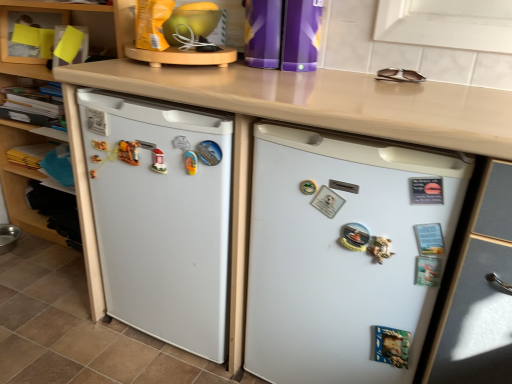
Question: Is white matte refrigerator at left, which is the second refrigerator from right to left, a part of wooden shelf at lower left, the 2th shelf from the top?

Choices:
 (A) yes
 (B) no

Answer: (B)

Question: Does wooden shelf at lower left, the 2th shelf from the top, have a larger size compared to white matte refrigerator at left, which ranks as the first refrigerator in left-to-right order?

Choices:
 (A) no
 (B) yes

Answer: (A)

Question: From the image's perspective, is wooden shelf at lower left, which is the first shelf in bottom-to-top order, on white matte refrigerator at left, which ranks as the first refrigerator in left-to-right order?

Choices:
 (A) yes
 (B) no

Answer: (B)

Question: Does wooden shelf at lower left, which is the first shelf in bottom-to-top order, appear on the right side of white matte refrigerator at left, which is the second refrigerator from right to left?

Choices:
 (A) yes
 (B) no

Answer: (B)

Question: Is wooden shelf at lower left, which is the first shelf in bottom-to-top order, further to camera compared to white matte refrigerator at left, which is the second refrigerator from right to left?

Choices:
 (A) no
 (B) yes

Answer: (B)

Question: Looking at the image, does wooden shelf at lower left, which is the first shelf in bottom-to-top order, seem bigger or smaller compared to yellow paper at upper left, arranged as the first shelf when viewed from the top?

Choices:
 (A) big
 (B) small

Answer: (A)

Question: Is point (29, 170) positioned closer to the camera than point (8, 9)?

Choices:
 (A) closer
 (B) farther

Answer: (A)

Question: Which is correct: wooden shelf at lower left, the 2th shelf from the top, is inside yellow paper at upper left, arranged as the first shelf when viewed from the top, or outside of it?

Choices:
 (A) inside
 (B) outside

Answer: (B)

Question: In terms of height, does wooden shelf at lower left, which is the first shelf in bottom-to-top order, look taller or shorter compared to yellow paper at upper left, the 2th shelf ordered from the bottom?

Choices:
 (A) tall
 (B) short

Answer: (B)

Question: Considering the positions of white matte refrigerator at left and white matte refrigerator at center, which appears as the 2th refrigerator when viewed from the left, in the image, is white matte refrigerator at left wider or thinner than white matte refrigerator at center, which appears as the 2th refrigerator when viewed from the left,?

Choices:
 (A) thin
 (B) wide

Answer: (B)

Question: From the image's perspective, relative to white matte refrigerator at center, acting as the 1th refrigerator starting from the right, is white matte refrigerator at left above or below?

Choices:
 (A) below
 (B) above

Answer: (B)

Question: In terms of height, does white matte refrigerator at left look taller or shorter compared to white matte refrigerator at center, acting as the 1th refrigerator starting from the right?

Choices:
 (A) short
 (B) tall

Answer: (B)

Question: Would you say white matte refrigerator at left is inside or outside white matte refrigerator at center, which appears as the 2th refrigerator when viewed from the left?

Choices:
 (A) outside
 (B) inside

Answer: (A)

Question: Is yellow paper at upper left, the 2th shelf ordered from the bottom, in front of or behind white matte refrigerator at left, which is the second refrigerator from right to left, in the image?

Choices:
 (A) front
 (B) behind

Answer: (B)

Question: Is yellow paper at upper left, arranged as the first shelf when viewed from the top, wider or thinner than white matte refrigerator at left, which is the second refrigerator from right to left?

Choices:
 (A) wide
 (B) thin

Answer: (B)